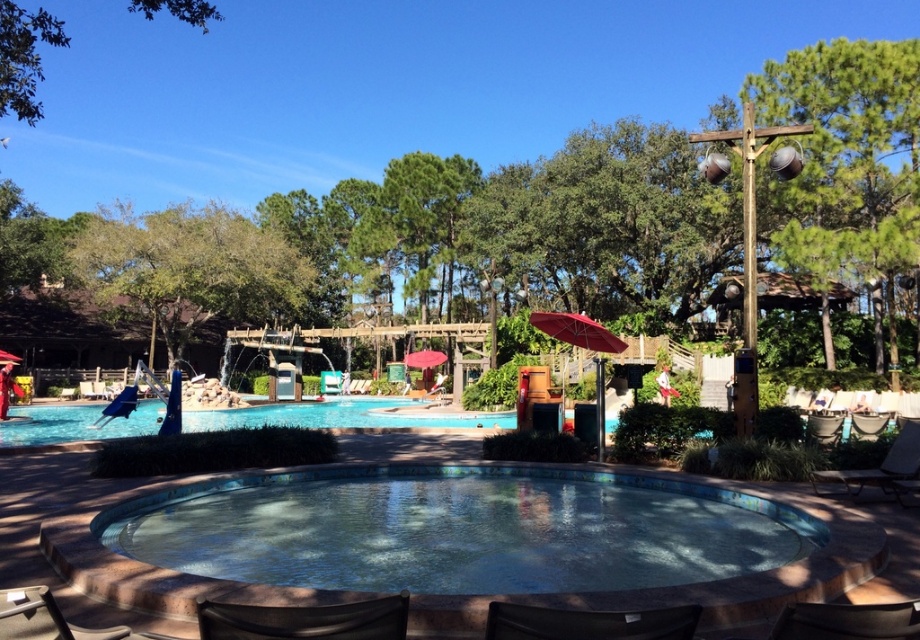
Describe the element at coordinates (877, 468) in the screenshot. I see `dark brown wooden lounge chair at lower right` at that location.

Is point (831, 490) positioned before point (884, 419)?

Yes, it is.

The height and width of the screenshot is (640, 920). Find the location of `dark brown wooden lounge chair at lower right`. dark brown wooden lounge chair at lower right is located at coordinates (877, 468).

Is blue mosaic pool at center in front of green leafy tree at upper right?

That is True.

Who is more distant from viewer, (x=600, y=528) or (x=823, y=99)?

The point (x=823, y=99) is behind.

Is point (508, 557) in front of point (868, 186)?

Yes, point (508, 557) is in front of point (868, 186).

The width and height of the screenshot is (920, 640). I want to click on blue mosaic pool at center, so click(460, 531).

Is green leafy tree at upper right below brown leather chair at lower left?

Incorrect, green leafy tree at upper right is not positioned below brown leather chair at lower left.

Who is lower down, green leafy tree at upper right or brown leather chair at lower left?

brown leather chair at lower left is below.

Does point (817, 157) come farther from viewer compared to point (52, 609)?

That is True.

Locate an element on the screen. Image resolution: width=920 pixels, height=640 pixels. green leafy tree at upper right is located at coordinates (846, 156).